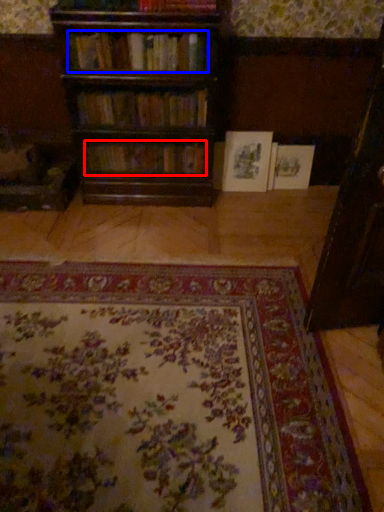
Question: Which of the following is the farthest to the observer, book (highlighted by a red box) or book (highlighted by a blue box)?

Choices:
 (A) book
 (B) book

Answer: (A)